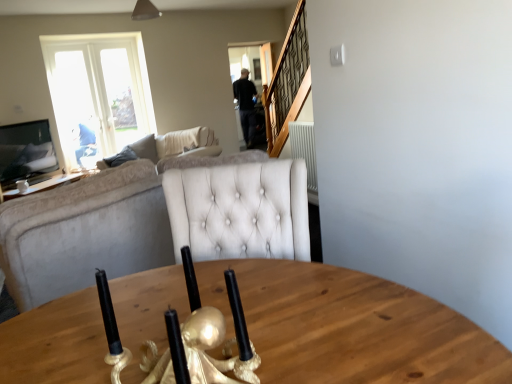
Question: Is white ceramic coffee cup at upper left turned away from beige fabric couch at left, which is the 1th studio couch in top-to-bottom order?

Choices:
 (A) yes
 (B) no

Answer: (B)

Question: Is white ceramic coffee cup at upper left facing towards beige fabric couch at left, which is the 1th studio couch in top-to-bottom order?

Choices:
 (A) yes
 (B) no

Answer: (B)

Question: Is the surface of white ceramic coffee cup at upper left in direct contact with beige fabric couch at left, which appears as the 2th studio couch when viewed from the front?

Choices:
 (A) no
 (B) yes

Answer: (A)

Question: Does white ceramic coffee cup at upper left come in front of beige fabric couch at left, which is the 1th studio couch in top-to-bottom order?

Choices:
 (A) yes
 (B) no

Answer: (B)

Question: Can you confirm if white ceramic coffee cup at upper left is wider than beige fabric couch at left, arranged as the second studio couch when ordered from the bottom?

Choices:
 (A) no
 (B) yes

Answer: (A)

Question: Considering the positions of point (254, 52) and point (100, 211), is point (254, 52) closer or farther from the camera than point (100, 211)?

Choices:
 (A) farther
 (B) closer

Answer: (A)

Question: Is transparent glass door at upper center to the left or to the right of velvet beige couch at left, which is the 2th studio couch in top-to-bottom order, in the image?

Choices:
 (A) right
 (B) left

Answer: (A)

Question: Is transparent glass door at upper center bigger or smaller than velvet beige couch at left, the first studio couch in the front-to-back sequence?

Choices:
 (A) small
 (B) big

Answer: (A)

Question: From the image's perspective, is transparent glass door at upper center positioned above or below velvet beige couch at left, the first studio couch in the front-to-back sequence?

Choices:
 (A) above
 (B) below

Answer: (A)

Question: Considering the positions of velvet beige couch at left, which appears as the 2th studio couch when viewed from the back, and white ceramic coffee cup at upper left in the image, is velvet beige couch at left, which appears as the 2th studio couch when viewed from the back, taller or shorter than white ceramic coffee cup at upper left?

Choices:
 (A) tall
 (B) short

Answer: (A)

Question: Considering the positions of point (117, 200) and point (19, 183), is point (117, 200) closer or farther from the camera than point (19, 183)?

Choices:
 (A) farther
 (B) closer

Answer: (B)

Question: Considering the positions of velvet beige couch at left, acting as the first studio couch starting from the bottom, and white ceramic coffee cup at upper left in the image, is velvet beige couch at left, acting as the first studio couch starting from the bottom, wider or thinner than white ceramic coffee cup at upper left?

Choices:
 (A) thin
 (B) wide

Answer: (B)

Question: From a real-world perspective, relative to white ceramic coffee cup at upper left, is velvet beige couch at left, acting as the first studio couch starting from the bottom, vertically above or below?

Choices:
 (A) above
 (B) below

Answer: (A)

Question: Relative to velvet beige couch at left, which is the 2th studio couch in top-to-bottom order, is beige fabric couch at left, which appears as the 2th studio couch when viewed from the front, in front or behind?

Choices:
 (A) front
 (B) behind

Answer: (B)

Question: In terms of height, does beige fabric couch at left, arranged as the second studio couch when ordered from the bottom, look taller or shorter compared to velvet beige couch at left, which is the 2th studio couch in top-to-bottom order?

Choices:
 (A) tall
 (B) short

Answer: (B)